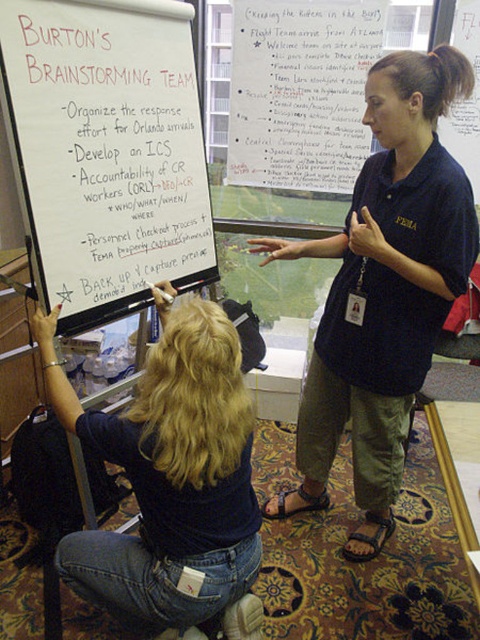
What do you see at coordinates (107, 150) in the screenshot? The width and height of the screenshot is (480, 640). I see `whiteboard at upper left` at bounding box center [107, 150].

Can you confirm if whiteboard at upper left is thinner than dark blue shirt at center?

Yes, whiteboard at upper left is thinner than dark blue shirt at center.

Does point (184, 29) come in front of point (471, 236)?

That is False.

The image size is (480, 640). Identify the location of whiteboard at upper left. (107, 150).

Where is `dark blue shirt at center`? The height and width of the screenshot is (640, 480). dark blue shirt at center is located at coordinates (384, 289).

Who is positioned more to the right, dark blue shirt at center or denim jeans at lower left?

dark blue shirt at center is more to the right.

At what (x,y) coordinates should I click in order to perform the action: click on dark blue shirt at center. Please return your answer as a coordinate pair (x, y). Image resolution: width=480 pixels, height=640 pixels. Looking at the image, I should click on (384, 289).

Is whiteboard at upper left in front of denim jeans at lower left?

No, it is not.

Who is positioned more to the left, whiteboard at upper left or denim jeans at lower left?

Positioned to the left is whiteboard at upper left.

Measure the distance between point (183, 65) and camera.

Point (183, 65) is 2.06 meters from camera.

Identify the location of whiteboard at upper left. (107, 150).